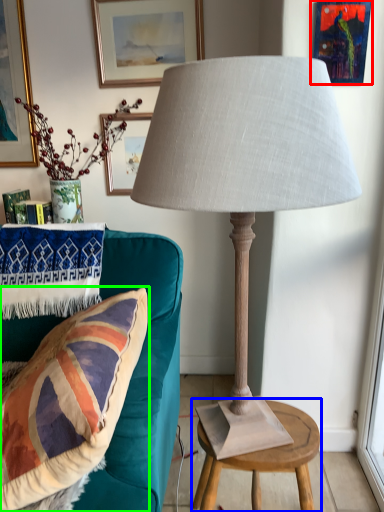
Question: Which object is the farthest from picture frame (highlighted by a red box)? Choose among these: table (highlighted by a blue box) or pillow (highlighted by a green box).

Choices:
 (A) table
 (B) pillow

Answer: (A)